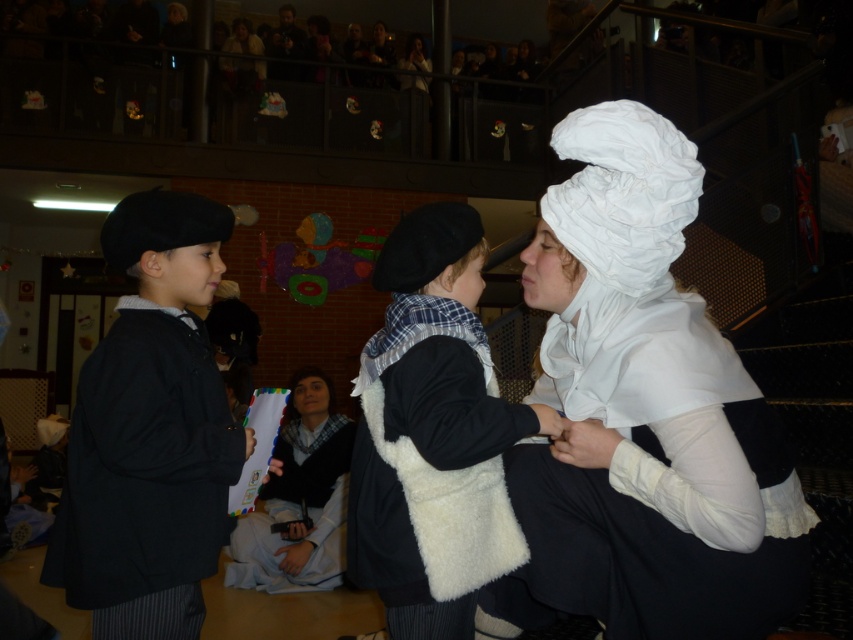
Question: Does white satin bonnet at center appear over white fluffy vest at center?

Choices:
 (A) no
 (B) yes

Answer: (B)

Question: Is white satin bonnet at center closer to the viewer compared to white fluffy vest at center?

Choices:
 (A) no
 (B) yes

Answer: (B)

Question: Which point is closer to the camera taking this photo?

Choices:
 (A) (554, 189)
 (B) (181, 566)
 (C) (453, 387)

Answer: (C)

Question: Can you confirm if matte black coat at left is bigger than white fluffy vest at center?

Choices:
 (A) no
 (B) yes

Answer: (A)

Question: Which of the following is the farthest from the observer?

Choices:
 (A) white satin bonnet at center
 (B) white fluffy vest at center
 (C) matte black coat at left

Answer: (C)

Question: Among these objects, which one is nearest to the camera?

Choices:
 (A) matte black coat at left
 (B) white fluffy vest at center

Answer: (B)